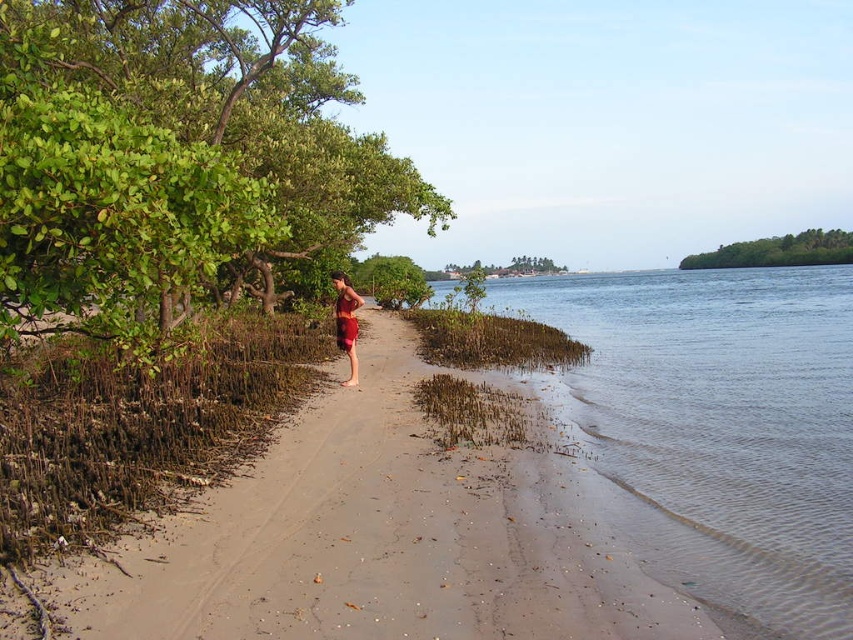
From the picture: You are planning to take a photo of the green leafy tree at left and the sandy beach at center. Which object should you focus on first if you want to capture both in a single frame without moving the camera?

The green leafy tree at left has a larger size compared to the sandy beach at center, so you should focus on the green leafy tree at left first to ensure it fits properly in the frame.

From the picture: You are standing at the start of the sandy path in the coastal scene. There are two points marked on the path. One is at coordinate point (351, 224) and the other is at point (560, 394). If you want to reach the point closer to you, which coordinate should you head towards?

You should head towards point (351, 224) because it is closer to you than point (560, 394).